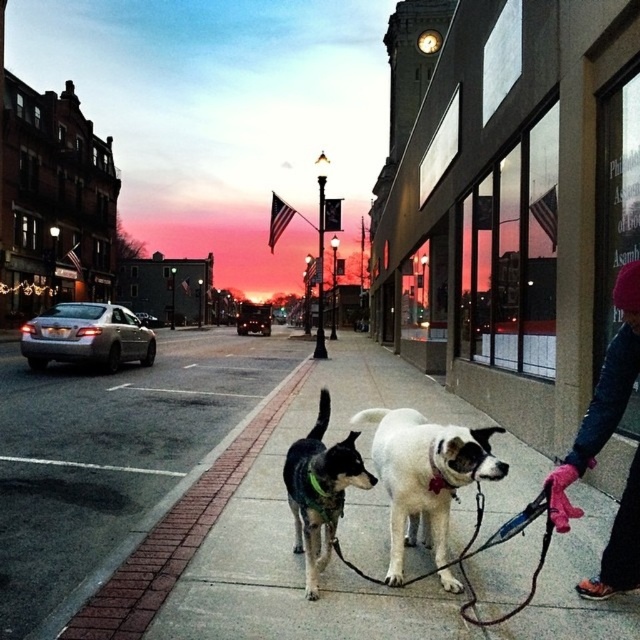
You are a photographer standing in the middle of the street. You notice the brick pavement at center and the black and white fur at center. Which object is closer to the ground?

The brick pavement at center is closer to the ground since it has a lesser height compared to the black and white fur at center.

You are a photographer standing on the street and want to take a photo of the black and white fur at center without the pink fleece gloves at lower right appearing in the frame. Is it possible to adjust your position so that the gloves are out of the shot?

The pink fleece gloves at lower right is positioned over the black and white fur at center, so adjusting your position might not help because the gloves are directly on top of the fur in the scene. They would likely still be in the frame if the fur is visible.